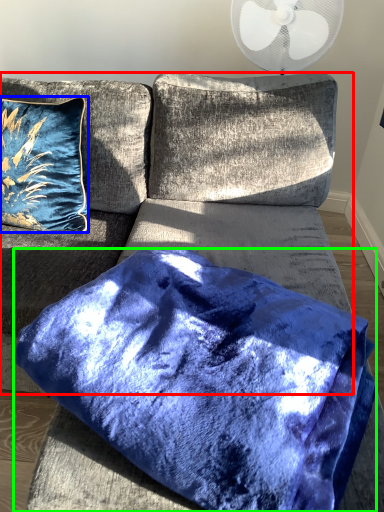
Question: Which object is positioned closest to couch (highlighted by a red box)? Select from pillow (highlighted by a blue box) and pillow (highlighted by a green box).

Choices:
 (A) pillow
 (B) pillow

Answer: (A)